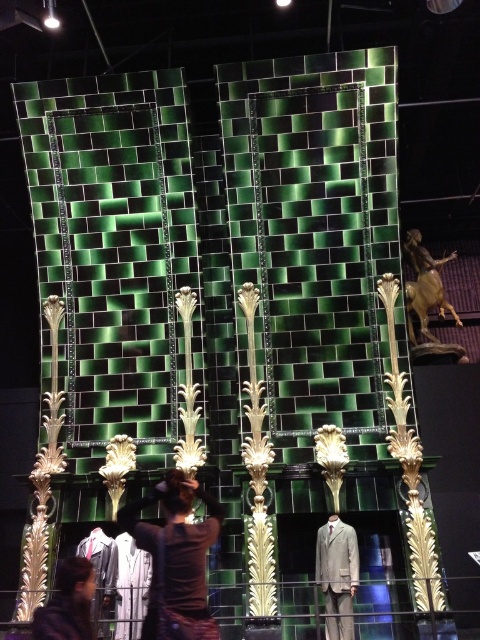
You are a visitor standing in front of the fireplace display. You see the brown fabric at center and the dark brown leather jacket at lower left. Which object is taller?

The brown fabric at center is taller than the dark brown leather jacket at lower left.